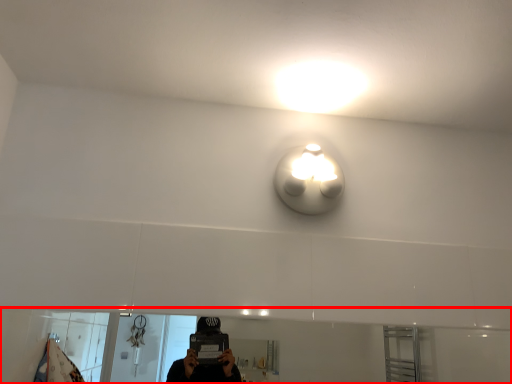
Question: From the image's perspective, what is the correct spatial positioning of mirror (annotated by the red box) in reference to light?

Choices:
 (A) above
 (B) below

Answer: (B)